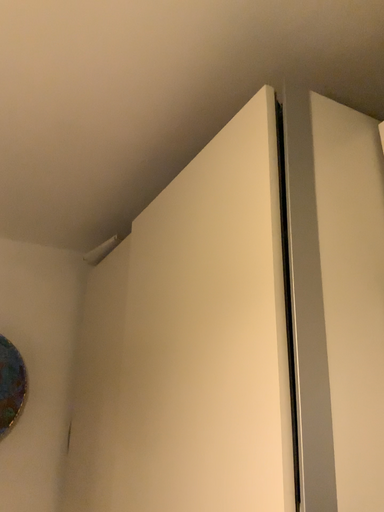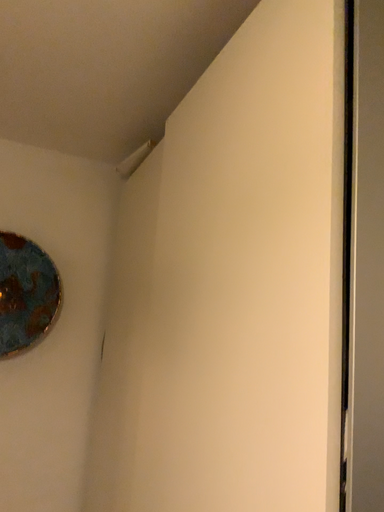
Question: Which way did the camera rotate in the video?

Choices:
 (A) rotated downward
 (B) rotated upward

Answer: (A)